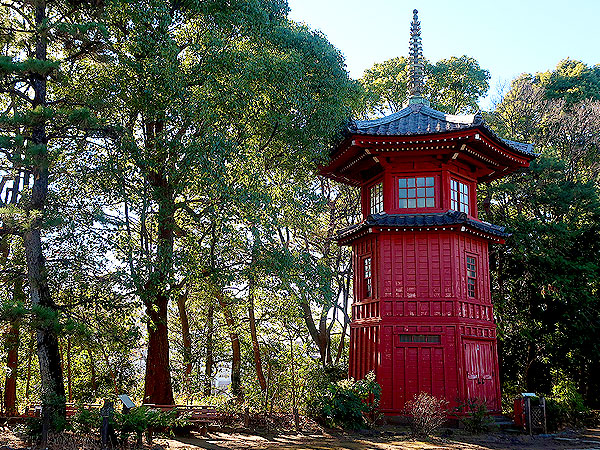
Locate an element on the screen. This screenshot has width=600, height=450. right window is located at coordinates (463, 200).